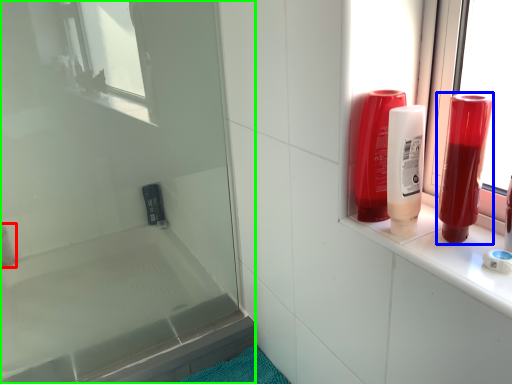
Question: Which object is the closest to the toiletry (highlighted by a red box)? Choose among these: mouthwash (highlighted by a blue box) or screen door (highlighted by a green box).

Choices:
 (A) mouthwash
 (B) screen door

Answer: (B)